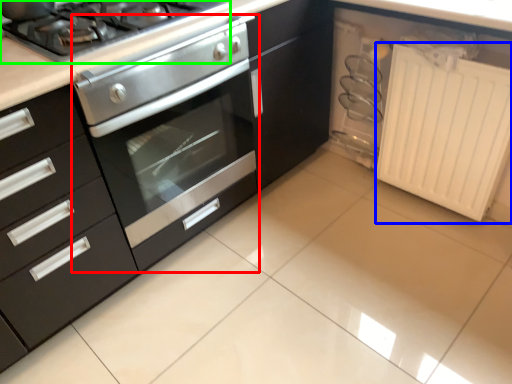
Question: Estimate the real-world distances between objects in this image. Which object is closer to oven (highlighted by a red box), radiator (highlighted by a blue box) or gas stove (highlighted by a green box)?

Choices:
 (A) radiator
 (B) gas stove

Answer: (B)